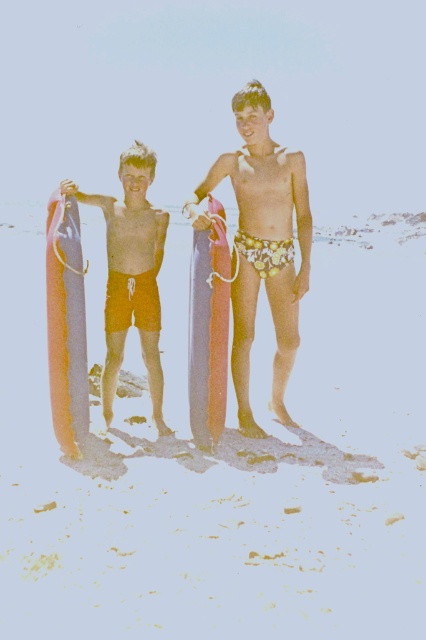
You are a photographer trying to capture the exact positions of the boys on the beach. According to the coordinates provided, where is the orange matte shorts at left located?

The orange matte shorts at left is located at coordinates point (132, 275).

You are standing on the beach and see a point marked at coordinates (118, 234). If you want to walk to that point, how far will you have to walk in feet?

The point at coordinates (118, 234) is 18.37 feet away from the viewer, so you would need to walk 18.37 feet to reach it.